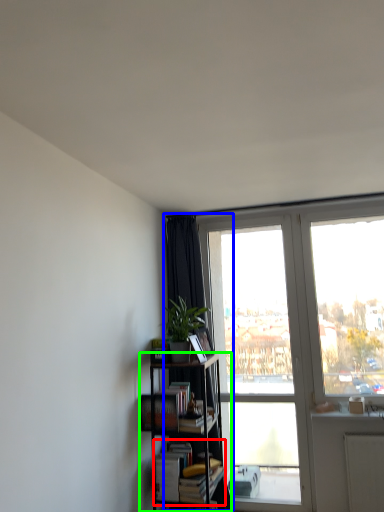
Question: Based on their relative distances, which object is nearer to book (highlighted by a red box)? Choose from curtain (highlighted by a blue box) and bookcase (highlighted by a green box).

Choices:
 (A) curtain
 (B) bookcase

Answer: (B)